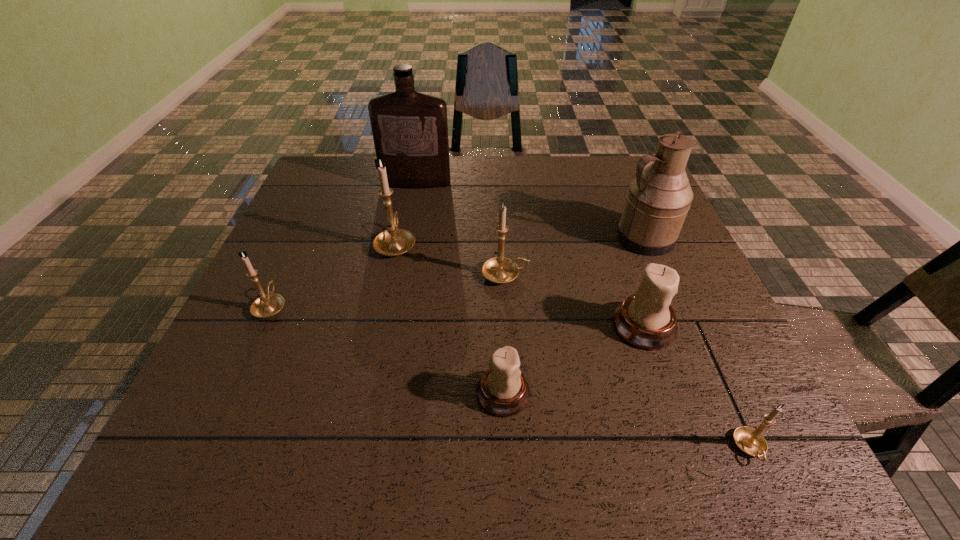
The height and width of the screenshot is (540, 960). What are the coordinates of `liquor` in the screenshot? It's located at [x=410, y=129].

Where is `pitcher`? pitcher is located at coordinates (659, 198).

Locate an element on the screen. This screenshot has width=960, height=540. the farthest candle holder is located at coordinates (392, 242).

Where is `the second gold candle holder from left to right`? The height and width of the screenshot is (540, 960). the second gold candle holder from left to right is located at coordinates (392, 242).

You are a GUI agent. You are given a task and a screenshot of the screen. Output one action in this format:
    pyautogui.click(x=<x>, y=<y>)
    Task: Click on the third smallest gold candle holder
    The width and height of the screenshot is (960, 540).
    Given the screenshot: What is the action you would take?
    pyautogui.click(x=500, y=270)

This screenshot has height=540, width=960. Find the location of `the fourth tallest object`. the fourth tallest object is located at coordinates (500, 270).

Locate an element on the screen. the right white candle holder is located at coordinates (646, 320).

At what (x,y) coordinates should I click in order to perform the action: click on the farther white candle holder. Please return your answer as a coordinate pair (x, y). The image size is (960, 540). Looking at the image, I should click on (646, 320).

Identify the location of the second smallest gold candle holder. (267, 305).

Find the location of a particular element. the leftmost gold candle holder is located at coordinates (267, 305).